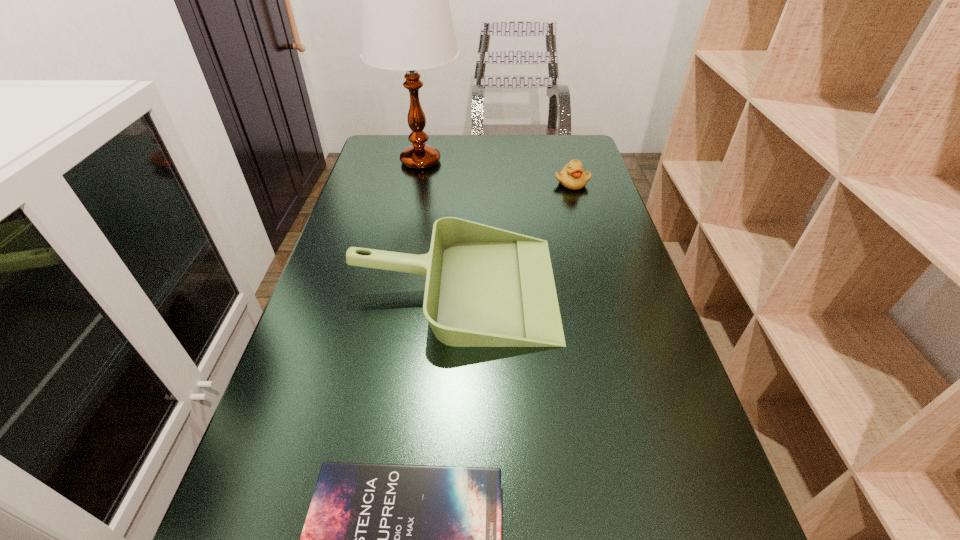
Locate which object is the second closest to the dustpan. Please provide its 2D coordinates. Your answer should be formatted as a tuple, i.e. [(x, y)], where the tuple contains the x and y coordinates of a point satisfying the conditions above.

[(379, 539)]

Image resolution: width=960 pixels, height=540 pixels. I want to click on free point that satisfies the following two spatial constraints: 1. at the beak of the second shortest object; 2. on the scoop of the second tallest object, so click(x=602, y=287).

Where is `vacant point that satisfies the following two spatial constraints: 1. at the beak of the rightmost object; 2. on the scoop of the dustpan`? The image size is (960, 540). vacant point that satisfies the following two spatial constraints: 1. at the beak of the rightmost object; 2. on the scoop of the dustpan is located at coordinates (602, 287).

Locate an element on the screen. This screenshot has height=540, width=960. vacant point that satisfies the following two spatial constraints: 1. at the beak of the rightmost object; 2. on the scoop of the third shortest object is located at coordinates (602, 287).